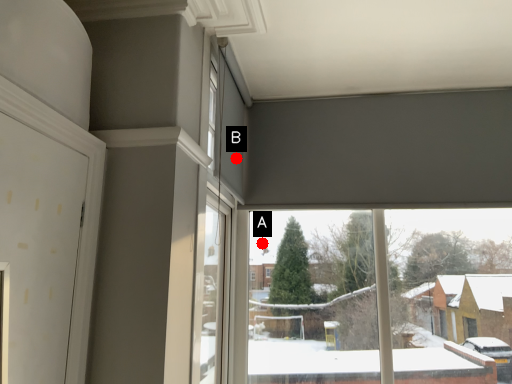
Question: Two points are circled on the image, labeled by A and B beside each circle. Which point is farther from the camera taking this photo?

Choices:
 (A) A is further
 (B) B is further

Answer: (A)